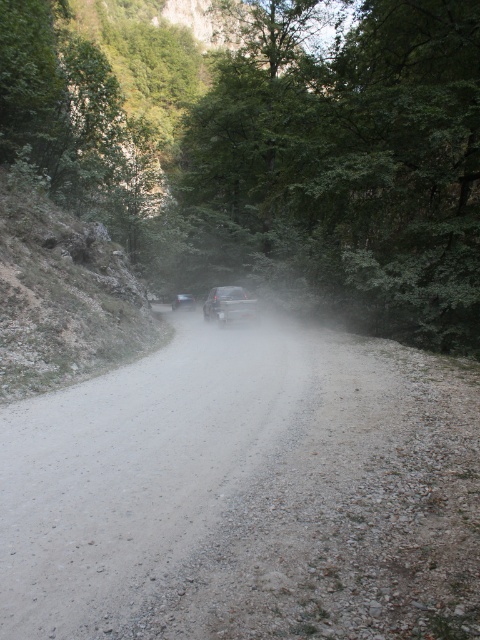
Question: Does gray gravel road at center appear on the right side of smokey gray car at center?

Choices:
 (A) yes
 (B) no

Answer: (A)

Question: Considering the real-world distances, which object is closest to the smokey gray car at center?

Choices:
 (A) gray gravel road at center
 (B) metallic silver car at center

Answer: (B)

Question: Which object appears farthest from the camera in this image?

Choices:
 (A) green leafy tree at center
 (B) gray gravel road at center
 (C) metallic silver car at center
 (D) smokey gray car at center

Answer: (D)

Question: Is green leafy tree at center smaller than metallic silver car at center?

Choices:
 (A) no
 (B) yes

Answer: (A)

Question: Does gray gravel road at center have a smaller size compared to smokey gray car at center?

Choices:
 (A) no
 (B) yes

Answer: (A)

Question: Estimate the real-world distances between objects in this image. Which object is farther from the smokey gray car at center?

Choices:
 (A) gray gravel road at center
 (B) green leafy tree at center

Answer: (A)